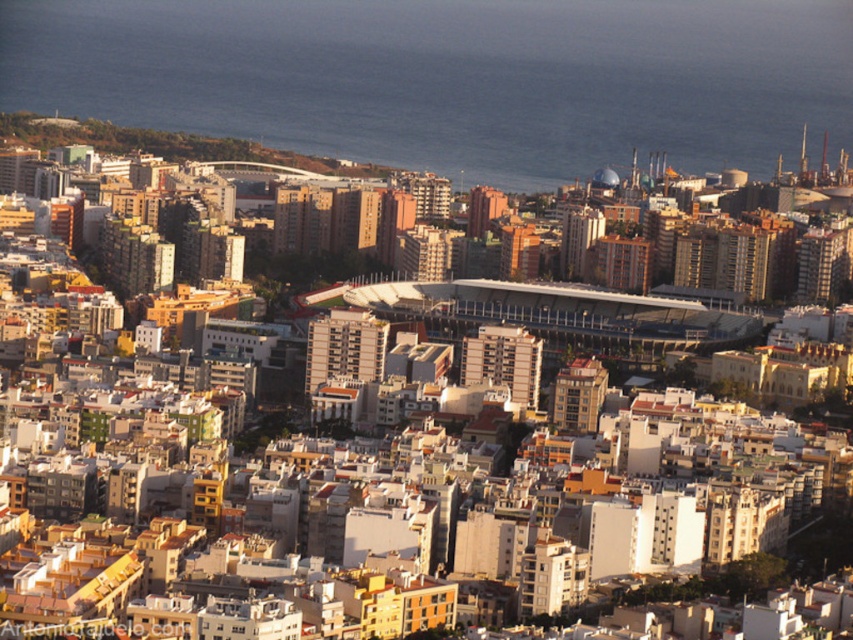
Question: Among these objects, which one is farthest from the camera?

Choices:
 (A) blue water at center
 (B) matte white dome at center

Answer: (B)

Question: Is blue water at center thinner than matte white dome at center?

Choices:
 (A) yes
 (B) no

Answer: (B)

Question: Among these points, which one is farthest from the camera?

Choices:
 (A) (599, 173)
 (B) (184, 100)

Answer: (B)

Question: Which of the following is the farthest from the observer?

Choices:
 (A) (598, 170)
 (B) (314, 10)

Answer: (B)

Question: Can you confirm if blue water at center is positioned above matte white dome at center?

Choices:
 (A) no
 (B) yes

Answer: (B)

Question: Can you confirm if blue water at center is positioned to the left of matte white dome at center?

Choices:
 (A) no
 (B) yes

Answer: (B)